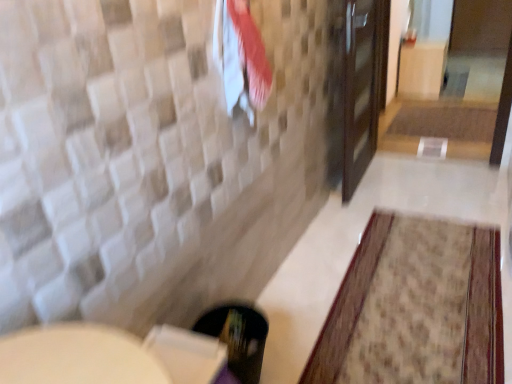
Question: Is brown textured bath mat at center, the 2th bath mat viewed from the front, shorter than white cotton beach towel at upper center?

Choices:
 (A) yes
 (B) no

Answer: (A)

Question: From the image's perspective, is brown textured bath mat at center, the 1th bath mat from the back, under white cotton beach towel at upper center?

Choices:
 (A) no
 (B) yes

Answer: (A)

Question: From a real-world perspective, is brown textured bath mat at center, the 1th bath mat from the back, beneath white cotton beach towel at upper center?

Choices:
 (A) no
 (B) yes

Answer: (B)

Question: Is brown textured bath mat at center, positioned as the 1th bath mat in top-to-bottom order, turned away from white cotton beach towel at upper center?

Choices:
 (A) no
 (B) yes

Answer: (A)

Question: From the image's perspective, is brown textured bath mat at center, the 2th bath mat viewed from the front, on white cotton beach towel at upper center?

Choices:
 (A) yes
 (B) no

Answer: (A)

Question: Does brown textured bath mat at center, the 2th bath mat viewed from the front, have a greater width compared to white cotton beach towel at upper center?

Choices:
 (A) no
 (B) yes

Answer: (B)

Question: Does brown textured bath mat at center, placed as the first bath mat when sorted from right to left, appear on the right side of beige textured rug at lower right, the first bath mat viewed from the front?

Choices:
 (A) no
 (B) yes

Answer: (B)

Question: Is beige textured rug at lower right, the second bath mat positioned from the back, completely or partially inside brown textured bath mat at center, the second bath mat when ordered from left to right?

Choices:
 (A) no
 (B) yes

Answer: (A)

Question: Does brown textured bath mat at center, positioned as the 1th bath mat in top-to-bottom order, have a smaller size compared to beige textured rug at lower right, placed as the first bath mat when sorted from left to right?

Choices:
 (A) no
 (B) yes

Answer: (A)

Question: Is brown textured bath mat at center, positioned as the 1th bath mat in top-to-bottom order, at the left side of beige textured rug at lower right, placed as the first bath mat when sorted from left to right?

Choices:
 (A) yes
 (B) no

Answer: (B)

Question: Does brown textured bath mat at center, positioned as the 1th bath mat in top-to-bottom order, have a lesser width compared to beige textured rug at lower right, the second bath mat viewed from the right?

Choices:
 (A) yes
 (B) no

Answer: (A)

Question: Is brown textured bath mat at center, the 2th bath mat viewed from the front, oriented away from beige textured rug at lower right, the 1th bath mat ordered from the bottom?

Choices:
 (A) yes
 (B) no

Answer: (B)

Question: Does white cotton beach towel at upper center have a greater width compared to beige textured rug at lower right, the 1th bath mat ordered from the bottom?

Choices:
 (A) yes
 (B) no

Answer: (B)